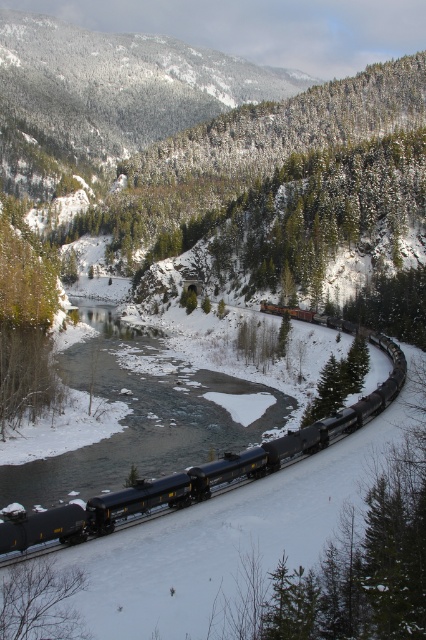
You are a passenger on the matte black train at lower center and want to look out the window to see the green textured pine at left. Which direction should you turn your head to see it?

The matte black train at lower center is to the right of the green textured pine at left, so you should turn your head to the left to see the green textured pine at left.

You are standing at the edge of the valley, looking at the matte black train at lower center and the green textured pine at left. If you want to walk to the pine tree first, which direction should you go from the train?

The matte black train at lower center is 45.59 meters away from the green textured pine at left. To reach the pine tree first, you should walk towards the left direction from the train.